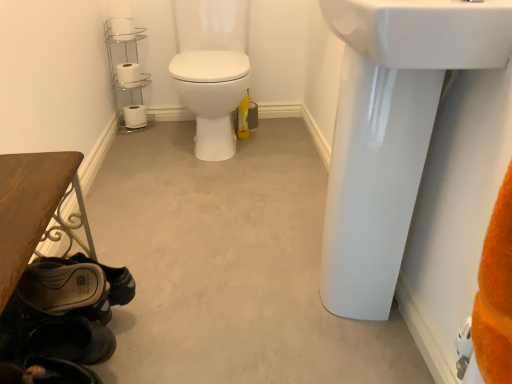
Describe the element at coordinates (128, 73) in the screenshot. I see `white matte toilet paper at upper left, placed as the second toilet paper when sorted from top to bottom` at that location.

The image size is (512, 384). What do you see at coordinates (127, 73) in the screenshot?
I see `chrome/metallic toilet paper holder at upper left` at bounding box center [127, 73].

What do you see at coordinates (63, 289) in the screenshot? I see `leather brown shoe at lower left` at bounding box center [63, 289].

Measure the distance between leather brown shoe at lower left, marked as the 1th shoe in a back-to-front arrangement, and camera.

They are 35.75 inches apart.

Locate an element on the screen. white matte toilet paper at upper left, which is counted as the 3th toilet paper, starting from the back is located at coordinates (121, 25).

From the image's perspective, is white matte toilet paper at upper left, which is counted as the 3th toilet paper, starting from the back, under chrome/metallic toilet paper holder at upper left?

Incorrect, from the image's perspective, white matte toilet paper at upper left, which is counted as the 3th toilet paper, starting from the back, is higher than chrome/metallic toilet paper holder at upper left.

Where is `shelf on the left of white matte toilet paper at upper left, the third toilet paper when ordered from bottom to top`? The width and height of the screenshot is (512, 384). shelf on the left of white matte toilet paper at upper left, the third toilet paper when ordered from bottom to top is located at coordinates (127, 73).

Choose the correct answer: Is white matte toilet paper at upper left, the third toilet paper when ordered from bottom to top, inside chrome/metallic toilet paper holder at upper left or outside it?

white matte toilet paper at upper left, the third toilet paper when ordered from bottom to top, is not inside chrome/metallic toilet paper holder at upper left, it's outside.

Does point (130, 18) appear closer or farther from the camera than point (135, 37)?

Point (130, 18) is closer to the camera than point (135, 37).

Does dark brown leather shoe at lower left, the second shoe when ordered from back to front, appear on the right side of white glossy sink at upper right, which is counted as the 2th sink, starting from the bottom?

No.

Is dark brown leather shoe at lower left, the second shoe when ordered from back to front, next to white glossy sink at upper right, which is the 1th sink in top-to-bottom order?

No, dark brown leather shoe at lower left, the second shoe when ordered from back to front, is not with white glossy sink at upper right, which is the 1th sink in top-to-bottom order.

Is point (39, 317) behind point (440, 29)?

Yes, point (39, 317) is behind point (440, 29).

Is dark brown leather shoe at lower left, the second shoe when ordered from back to front, outside of white glossy sink at upper right, which is counted as the 2th sink, starting from the bottom?

Yes, dark brown leather shoe at lower left, the second shoe when ordered from back to front, is located beyond the bounds of white glossy sink at upper right, which is counted as the 2th sink, starting from the bottom.

Identify the location of the 1st shoe below the white glossy sink at upper right, which is the 1th sink in top-to-bottom order (from the image's perspective). This screenshot has height=384, width=512. (105, 276).

Is the surface of white glossy sink at upper right, which is the 1th sink in top-to-bottom order, in direct contact with leather brown shoe at lower left, marked as the 1th shoe in a back-to-front arrangement?

They are not placed beside each other.

Which object is further away from the camera taking this photo, white glossy sink at upper right, which is counted as the 2th sink, starting from the bottom, or leather brown shoe at lower left, the second shoe when ordered from front to back?

leather brown shoe at lower left, the second shoe when ordered from front to back, is behind.

Is white glossy sink at upper right, which is counted as the 2th sink, starting from the bottom, taller or shorter than leather brown shoe at lower left, the second shoe when ordered from front to back?

white glossy sink at upper right, which is counted as the 2th sink, starting from the bottom, is taller than leather brown shoe at lower left, the second shoe when ordered from front to back.

Which object is thinner, chrome/metallic toilet paper holder at upper left or white glossy sink at upper right, which is counted as the 2th sink, starting from the bottom?

Thinner between the two is chrome/metallic toilet paper holder at upper left.

Which is correct: chrome/metallic toilet paper holder at upper left is inside white glossy sink at upper right, which is the 1th sink in top-to-bottom order, or outside of it?

chrome/metallic toilet paper holder at upper left is not enclosed by white glossy sink at upper right, which is the 1th sink in top-to-bottom order.

Is chrome/metallic toilet paper holder at upper left positioned with its back to white glossy sink at upper right, which is the 1th sink in top-to-bottom order?

No.

Can you confirm if white glossy sink at upper right, which is counted as the 2th sink, starting from the bottom, is thinner than chrome/metallic toilet paper holder at upper left?

No.

Consider the image. How many degrees apart are the facing directions of white glossy sink at upper right, which is the 1th sink in top-to-bottom order, and chrome/metallic toilet paper holder at upper left?

89.2 degrees.

Is white glossy sink at upper right, which is the 1th sink in top-to-bottom order, taller or shorter than chrome/metallic toilet paper holder at upper left?

Clearly, white glossy sink at upper right, which is the 1th sink in top-to-bottom order, is shorter compared to chrome/metallic toilet paper holder at upper left.

From the chrome/metallic toilet paper holder at upper left, count 2nd sink to the right and point to it. Please provide its 2D coordinates.

[(424, 32)]

Are leather brown shoe at lower left and white matte toilet paper at lower left, which is counted as the third toilet paper, starting from the front, located far from each other?

Yes.

Is leather brown shoe at lower left situated inside white matte toilet paper at lower left, which is the 3th toilet paper from top to bottom, or outside?

leather brown shoe at lower left cannot be found inside white matte toilet paper at lower left, which is the 3th toilet paper from top to bottom.

Is leather brown shoe at lower left further to camera compared to white matte toilet paper at lower left, arranged as the 1th toilet paper when viewed from the back?

No, leather brown shoe at lower left is closer to the camera.

Who is smaller, leather brown shoe at lower left or white matte toilet paper at lower left, which is counted as the third toilet paper, starting from the front?

With smaller size is leather brown shoe at lower left.

Is dark brown leather shoe at lower left, the second shoe when ordered from back to front, at the back of chrome/metallic toilet paper holder at upper left?

No, chrome/metallic toilet paper holder at upper left is not facing away from dark brown leather shoe at lower left, the second shoe when ordered from back to front.

Does point (132, 25) appear closer or farther from the camera than point (46, 352)?

Point (132, 25) is positioned farther from the camera compared to point (46, 352).

Can you confirm if chrome/metallic toilet paper holder at upper left is taller than dark brown leather shoe at lower left, the second shoe when ordered from back to front?

Result: Correct, chrome/metallic toilet paper holder at upper left is much taller as dark brown leather shoe at lower left, the second shoe when ordered from back to front.

Image resolution: width=512 pixels, height=384 pixels. What are the coordinates of `shoe that is the 2nd one when counting downward from the chrome/metallic toilet paper holder at upper left (from the image's perspective)` in the screenshot? It's located at (64, 311).

Where is `shelf located behind the white matte toilet paper at upper left, which is counted as the 3th toilet paper, starting from the back`? The height and width of the screenshot is (384, 512). shelf located behind the white matte toilet paper at upper left, which is counted as the 3th toilet paper, starting from the back is located at coordinates (127, 73).

The image size is (512, 384). What are the coordinates of `the 2nd shoe to the left of the white glossy sink at upper right, which is the 1th sink in top-to-bottom order, starting your count from the anchor` in the screenshot? It's located at (64, 311).

Considering their positions, is leather brown shoe at lower left positioned further to white matte toilet paper at lower left, which is counted as the third toilet paper, starting from the front, than white glossy sink at upper right, which is the 1th sink in top-to-bottom order?

white glossy sink at upper right, which is the 1th sink in top-to-bottom order, lies further to white matte toilet paper at lower left, which is counted as the third toilet paper, starting from the front, than the other object.

When comparing their distances from white matte toilet paper at upper left, the 2th toilet paper from the back, does leather brown shoe at lower left, marked as the 1th shoe in a back-to-front arrangement, or dark brown leather shoe at lower left, the first shoe in the front-to-back sequence, seem further?

dark brown leather shoe at lower left, the first shoe in the front-to-back sequence, lies further to white matte toilet paper at upper left, the 2th toilet paper from the back, than the other object.

Estimate the real-world distances between objects in this image. Which object is closer to white matte toilet paper at lower left, which is counted as the third toilet paper, starting from the front, white matte toilet paper at upper left, placed as the second toilet paper when sorted from top to bottom, or leather brown shoe at lower left?

The object closer to white matte toilet paper at lower left, which is counted as the third toilet paper, starting from the front, is white matte toilet paper at upper left, placed as the second toilet paper when sorted from top to bottom.

Based on their spatial positions, is chrome/metallic toilet paper holder at upper left or leather brown shoe at lower left, the second shoe when ordered from front to back, closer to white matte toilet paper at lower left, which is the 3th toilet paper from top to bottom?

chrome/metallic toilet paper holder at upper left is positioned closer to the anchor white matte toilet paper at lower left, which is the 3th toilet paper from top to bottom.

Looking at the image, which one is located further to white matte toilet paper at upper left, acting as the second toilet paper starting from the bottom, chrome/metallic toilet paper holder at upper left or leather brown shoe at lower left, the second shoe when ordered from front to back?

leather brown shoe at lower left, the second shoe when ordered from front to back, lies further to white matte toilet paper at upper left, acting as the second toilet paper starting from the bottom, than the other object.

Considering their positions, is white matte toilet paper at upper left, the third toilet paper when ordered from bottom to top, positioned further to leather brown shoe at lower left, marked as the 1th shoe in a back-to-front arrangement, than white matte toilet paper at upper left, acting as the second toilet paper starting from the bottom?

Based on the image, white matte toilet paper at upper left, the third toilet paper when ordered from bottom to top, appears to be further to leather brown shoe at lower left, marked as the 1th shoe in a back-to-front arrangement.

Looking at the image, which one is located further to leather brown shoe at lower left, leather brown shoe at lower left, marked as the 1th shoe in a back-to-front arrangement, or white matte toilet paper at upper left, which is the 1th toilet paper in front-to-back order?

A: white matte toilet paper at upper left, which is the 1th toilet paper in front-to-back order.

When comparing their distances from chrome/metallic toilet paper holder at upper left, does white matte toilet paper at upper left, the third toilet paper when ordered from bottom to top, or dark brown leather shoe at lower left, the second shoe when ordered from back to front, seem closer?

white matte toilet paper at upper left, the third toilet paper when ordered from bottom to top, is positioned closer to the anchor chrome/metallic toilet paper holder at upper left.

I want to click on toilet paper between white glossy sink at upper right, the first sink in the bottom-to-top sequence, and chrome/metallic toilet paper holder at upper left in the front-back direction, so click(121, 25).

Locate an element on the screen. This screenshot has width=512, height=384. footwear between white glossy sink at upper right, the first sink in the bottom-to-top sequence, and chrome/metallic toilet paper holder at upper left, along the z-axis is located at coordinates (63, 289).

This screenshot has height=384, width=512. Find the location of `toilet paper between white glossy sink at upper right, which is counted as the 2th sink, starting from the bottom, and white matte toilet paper at upper left, the 2th toilet paper from the back, in the front-back direction`. toilet paper between white glossy sink at upper right, which is counted as the 2th sink, starting from the bottom, and white matte toilet paper at upper left, the 2th toilet paper from the back, in the front-back direction is located at coordinates (121, 25).

Where is `shoe positioned between leather brown shoe at lower left and white matte toilet paper at upper left, acting as the second toilet paper starting from the bottom, from near to far`? The image size is (512, 384). shoe positioned between leather brown shoe at lower left and white matte toilet paper at upper left, acting as the second toilet paper starting from the bottom, from near to far is located at coordinates (105, 276).